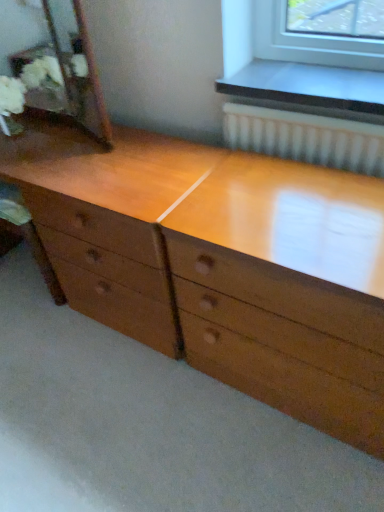
Question: Is wooden mirror at left thinner than light brown wood chest of drawers at center?

Choices:
 (A) no
 (B) yes

Answer: (B)

Question: From the image's perspective, does wooden mirror at left appear lower than light brown wood chest of drawers at center?

Choices:
 (A) no
 (B) yes

Answer: (A)

Question: Is wooden mirror at left behind light brown wood chest of drawers at center?

Choices:
 (A) yes
 (B) no

Answer: (A)

Question: Can you confirm if wooden mirror at left is positioned to the right of light brown wood chest of drawers at center?

Choices:
 (A) no
 (B) yes

Answer: (A)

Question: Does wooden mirror at left touch light brown wood chest of drawers at center?

Choices:
 (A) no
 (B) yes

Answer: (A)

Question: Considering the relative sizes of wooden mirror at left and light brown wood chest of drawers at center in the image provided, is wooden mirror at left bigger than light brown wood chest of drawers at center?

Choices:
 (A) no
 (B) yes

Answer: (A)

Question: From a real-world perspective, is light brown wood chest of drawers at center on top of wooden mirror at left?

Choices:
 (A) yes
 (B) no

Answer: (B)

Question: Is light brown wood chest of drawers at center thinner than wooden mirror at left?

Choices:
 (A) no
 (B) yes

Answer: (A)

Question: Is light brown wood chest of drawers at center shorter than wooden mirror at left?

Choices:
 (A) yes
 (B) no

Answer: (B)

Question: Can you confirm if light brown wood chest of drawers at center is positioned to the left of wooden mirror at left?

Choices:
 (A) no
 (B) yes

Answer: (A)

Question: Is light brown wood chest of drawers at center surrounding wooden mirror at left?

Choices:
 (A) yes
 (B) no

Answer: (B)

Question: Considering the relative positions of light brown wood chest of drawers at center and wooden mirror at left in the image provided, is light brown wood chest of drawers at center to the right of wooden mirror at left from the viewer's perspective?

Choices:
 (A) no
 (B) yes

Answer: (B)

Question: From the image's perspective, is light brown wood chest of drawers at center located above or below wooden mirror at left?

Choices:
 (A) above
 (B) below

Answer: (B)